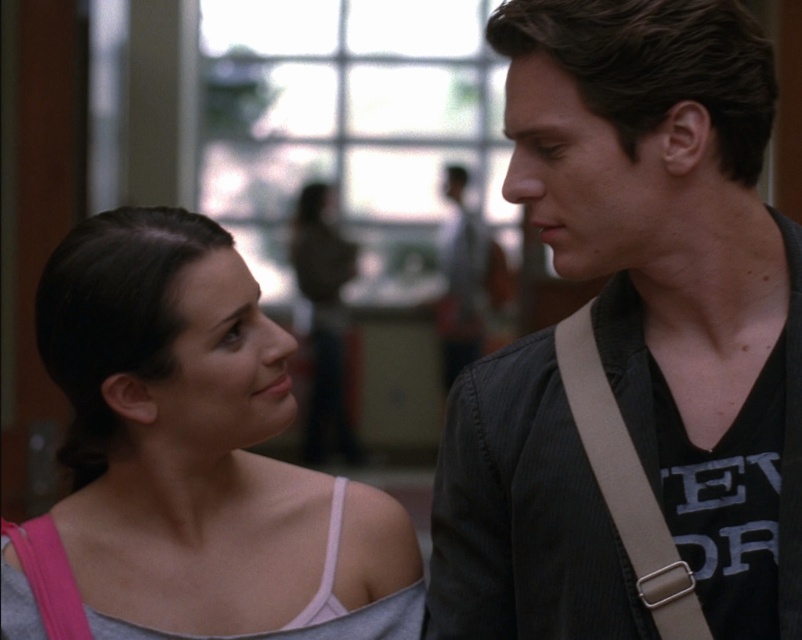
You are a photographer trying to capture a candid shot of the two people in the scene. You want to ensure that both the dark gray corduroy jacket at center and the tan fabric strap at right are clearly visible in the frame. Given their distance apart, can you fit both into a standard camera frame that has a maximum width of 6 inches?

The dark gray corduroy jacket at center and tan fabric strap at right are 5.78 inches apart from each other. Since the distance between them is less than the camera frame width of 6 inches, both can be captured clearly in the frame.